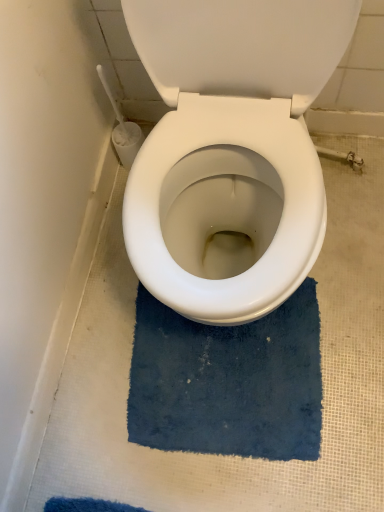
Identify the location of dark blue plush bath mat at center. (228, 381).

This screenshot has height=512, width=384. What do you see at coordinates (228, 381) in the screenshot?
I see `dark blue plush bath mat at center` at bounding box center [228, 381].

The width and height of the screenshot is (384, 512). Find the location of `dark blue plush bath mat at center`. dark blue plush bath mat at center is located at coordinates (x=228, y=381).